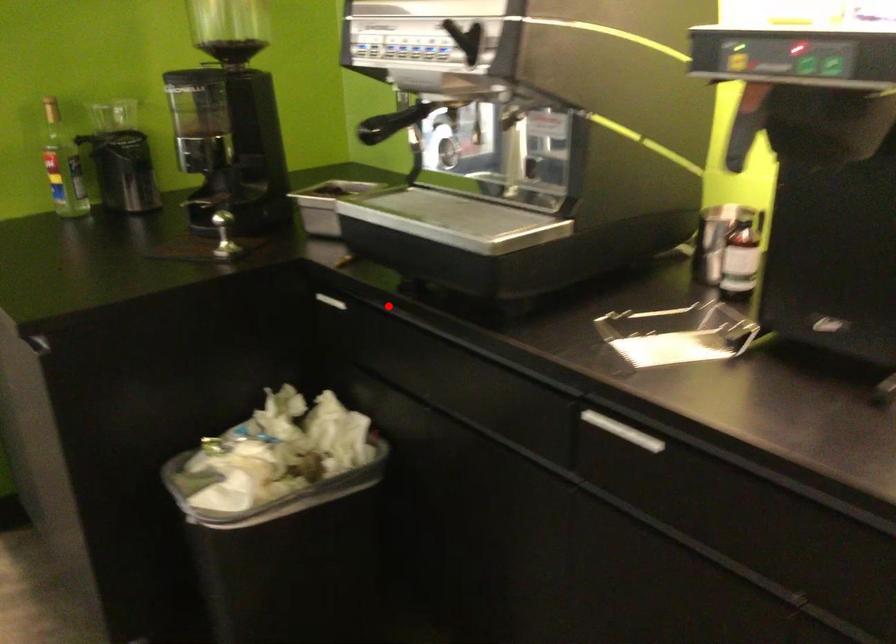
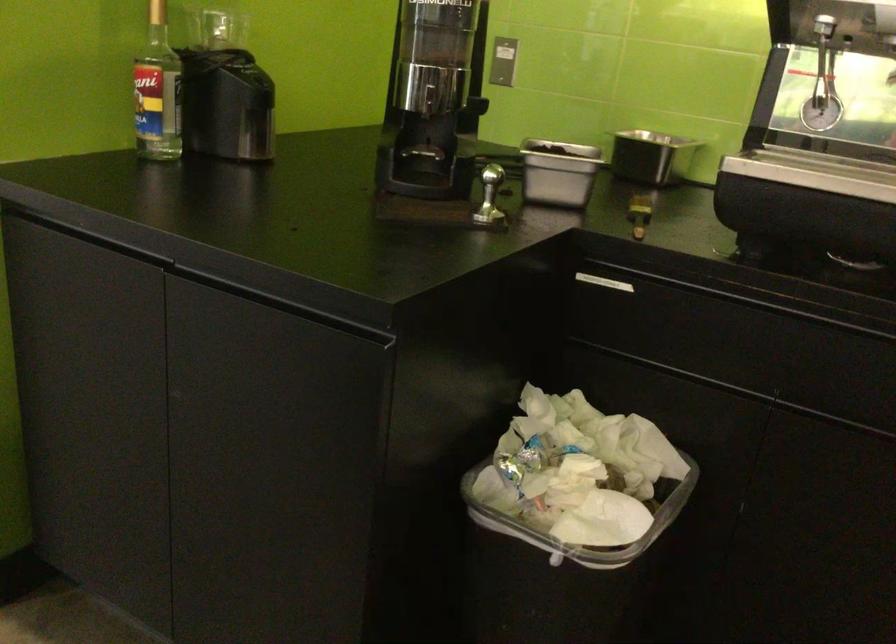
Question: I am providing you with two images of the same scene from different viewpoints. Image1 has a red point marked. In image2, the corresponding 3D location appears at what relative position? Reply with the corresponding letter.

Choices:
 (A) Closer
 (B) Farther

Answer: (A)